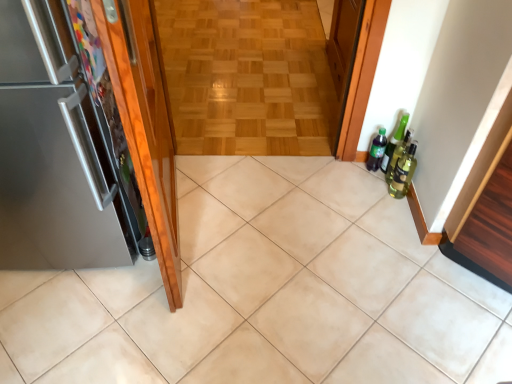
Locate an element on the screen. The width and height of the screenshot is (512, 384). green glass bottle at right, which ranks as the 2th beer bottle in back-to-front order is located at coordinates (403, 172).

The width and height of the screenshot is (512, 384). Describe the element at coordinates (53, 152) in the screenshot. I see `satin metallic refrigerator at left, the 1th door in the left-to-right sequence` at that location.

In order to face wooden parquet floor at center, should I rotate leftwards or rightwards?

A 1.304 degree turn to the left will do.

Find the location of a particular element. The height and width of the screenshot is (384, 512). green glass bottle at right, which ranks as the 2th beer bottle in back-to-front order is located at coordinates (403, 172).

Between green matte bottle at right and shiny wood door at left, the second door from the left, which one has smaller width?

With smaller width is green matte bottle at right.

Is green matte bottle at right next to shiny wood door at left, the second door from the left?

No, green matte bottle at right is not in contact with shiny wood door at left, the second door from the left.

In terms of height, does green matte bottle at right look taller or shorter compared to shiny wood door at left, arranged as the first door when viewed from the right?

green matte bottle at right is shorter than shiny wood door at left, arranged as the first door when viewed from the right.

How different are the orientations of green matte bottle at right and shiny wood door at left, arranged as the first door when viewed from the right, in degrees?

99 degrees separate the facing orientations of green matte bottle at right and shiny wood door at left, arranged as the first door when viewed from the right.

Considering the relative positions of green glass beer bottle at right, which is counted as the 2th beer bottle, starting from the front, and beige ceramic tile at center in the image provided, is green glass beer bottle at right, which is counted as the 2th beer bottle, starting from the front, in front of beige ceramic tile at center?

No, the depth of green glass beer bottle at right, which is counted as the 2th beer bottle, starting from the front, is greater than that of beige ceramic tile at center.

Is beige ceramic tile at center at the back of green glass beer bottle at right, which is counted as the 2th beer bottle, starting from the front?

No, beige ceramic tile at center is not at the back of green glass beer bottle at right, which is counted as the 2th beer bottle, starting from the front.

Is green glass beer bottle at right, which is counted as the 2th beer bottle, starting from the front, bigger or smaller than beige ceramic tile at center?

Clearly, green glass beer bottle at right, which is counted as the 2th beer bottle, starting from the front, is smaller in size than beige ceramic tile at center.

Is green glass beer bottle at right, which is counted as the 2th beer bottle, starting from the front, wider than beige ceramic tile at center?

In fact, green glass beer bottle at right, which is counted as the 2th beer bottle, starting from the front, might be narrower than beige ceramic tile at center.

From the image's perspective, who appears lower, green glass beer bottle at right, the first beer bottle positioned from the back, or shiny wood door at left, arranged as the first door when viewed from the right?

From the image's view, green glass beer bottle at right, the first beer bottle positioned from the back, is below.

Consider the image. From a real-world perspective, between green glass beer bottle at right, which is counted as the 2th beer bottle, starting from the front, and shiny wood door at left, arranged as the first door when viewed from the right, who is vertically lower?

green glass beer bottle at right, which is counted as the 2th beer bottle, starting from the front, from a real-world perspective.

Is point (400, 120) positioned in front of point (154, 131)?

No, it is behind (154, 131).

Is satin metallic refrigerator at left, which is the 2th door in right-to-left order, turned away from green glass beer bottle at right, the first beer bottle positioned from the back?

satin metallic refrigerator at left, which is the 2th door in right-to-left order, does not have its back to green glass beer bottle at right, the first beer bottle positioned from the back.

Is satin metallic refrigerator at left, which is the 2th door in right-to-left order, bigger than green glass beer bottle at right, which is counted as the 2th beer bottle, starting from the front?

Yes, satin metallic refrigerator at left, which is the 2th door in right-to-left order, is bigger than green glass beer bottle at right, which is counted as the 2th beer bottle, starting from the front.

Can you confirm if satin metallic refrigerator at left, the 1th door in the left-to-right sequence, is wider than green glass beer bottle at right, the first beer bottle positioned from the back?

Correct, the width of satin metallic refrigerator at left, the 1th door in the left-to-right sequence, exceeds that of green glass beer bottle at right, the first beer bottle positioned from the back.

There is a green glass beer bottle at right, which is counted as the 2th beer bottle, starting from the front. Identify the location of the 1st door above it (from a real-world perspective). (53, 152).

Measure the distance from green matte bottle at right to wooden parquet floor at center.

They are 1.11 meters apart.

Can you confirm if green matte bottle at right is bigger than wooden parquet floor at center?

Actually, green matte bottle at right might be smaller than wooden parquet floor at center.

Is green matte bottle at right situated inside wooden parquet floor at center or outside?

green matte bottle at right exists outside the volume of wooden parquet floor at center.

Locate an element on the screen. This screenshot has height=384, width=512. corridor directly beneath the green matte bottle at right (from a real-world perspective) is located at coordinates (256, 74).

Which is more to the left, satin metallic refrigerator at left, which is the 2th door in right-to-left order, or shiny wood door at left, the second door from the left?

From the viewer's perspective, satin metallic refrigerator at left, which is the 2th door in right-to-left order, appears more on the left side.

Can you confirm if satin metallic refrigerator at left, which is the 2th door in right-to-left order, is shorter than shiny wood door at left, arranged as the first door when viewed from the right?

Yes.

Does satin metallic refrigerator at left, which is the 2th door in right-to-left order, have a lesser width compared to shiny wood door at left, arranged as the first door when viewed from the right?

No.

From a real-world perspective, does satin metallic refrigerator at left, the 1th door in the left-to-right sequence, sit lower than shiny wood door at left, arranged as the first door when viewed from the right?

Yes, from a real-world perspective, satin metallic refrigerator at left, the 1th door in the left-to-right sequence, is below shiny wood door at left, arranged as the first door when viewed from the right.

How far apart are beige ceramic tile at center and green matte bottle at right?

32.94 inches.

Considering the sizes of objects beige ceramic tile at center and green matte bottle at right in the image provided, who is shorter, beige ceramic tile at center or green matte bottle at right?

beige ceramic tile at center.

From a real-world perspective, does beige ceramic tile at center sit lower than green matte bottle at right?

Yes, from a real-world perspective, beige ceramic tile at center is below green matte bottle at right.

Between beige ceramic tile at center and green matte bottle at right, which one is positioned behind?

green matte bottle at right is further from the camera.

Identify the location of bottle below the shiny wood door at left, the second door from the left (from a real-world perspective). This screenshot has width=512, height=384. (377, 150).

Locate an element on the screen. beer bottle that is the 2nd one when counting backward from the beige ceramic tile at center is located at coordinates (394, 143).

Considering their positions, is shiny wood door at left, arranged as the first door when viewed from the right, positioned closer to green matte bottle at right than beige ceramic tile at center?

The object closer to green matte bottle at right is beige ceramic tile at center.

Looking at this image, looking at the image, which one is located closer to green glass beer bottle at right, which is counted as the 2th beer bottle, starting from the front, green glass bottle at right, which ranks as the 2th beer bottle in back-to-front order, or green matte bottle at right?

green matte bottle at right is closer to green glass beer bottle at right, which is counted as the 2th beer bottle, starting from the front.

Estimate the real-world distances between objects in this image. Which object is closer to wooden cabinet at right, beige ceramic tile at center or wooden parquet floor at center?

beige ceramic tile at center.

Considering their positions, is beige ceramic tile at center positioned closer to wooden parquet floor at center than wooden cabinet at right?

beige ceramic tile at center.

When comparing their distances from wooden cabinet at right, does shiny wood door at left, arranged as the first door when viewed from the right, or satin metallic refrigerator at left, the 1th door in the left-to-right sequence, seem closer?

The object closer to wooden cabinet at right is shiny wood door at left, arranged as the first door when viewed from the right.

Looking at the image, which one is located closer to satin metallic refrigerator at left, the 1th door in the left-to-right sequence, wooden cabinet at right or green glass beer bottle at right, which is counted as the 2th beer bottle, starting from the front?

Based on the image, wooden cabinet at right appears to be nearer to satin metallic refrigerator at left, the 1th door in the left-to-right sequence.

From the image, which object appears to be nearer to green glass bottle at right, the 1th beer bottle viewed from the front, wooden cabinet at right or wooden parquet floor at center?

wooden cabinet at right lies closer to green glass bottle at right, the 1th beer bottle viewed from the front, than the other object.

Consider the image. Looking at the image, which one is located further to beige ceramic tile at center, green glass beer bottle at right, the first beer bottle positioned from the back, or wooden cabinet at right?

The object further to beige ceramic tile at center is green glass beer bottle at right, the first beer bottle positioned from the back.

Image resolution: width=512 pixels, height=384 pixels. In order to click on cabinetry between shiny wood door at left, the second door from the left, and wooden parquet floor at center from front to back in this screenshot , I will do click(x=487, y=225).

I want to click on ceramic tile positioned between shiny wood door at left, arranged as the first door when viewed from the right, and green matte bottle at right from near to far, so click(x=266, y=292).

In order to click on bottle situated between satin metallic refrigerator at left, which is the 2th door in right-to-left order, and green glass bottle at right, the 1th beer bottle viewed from the front, from left to right in this screenshot , I will do `click(377, 150)`.

Identify the location of bottle between wooden parquet floor at center and green glass bottle at right, the 1th beer bottle viewed from the front, in the up-down direction. The image size is (512, 384). (377, 150).